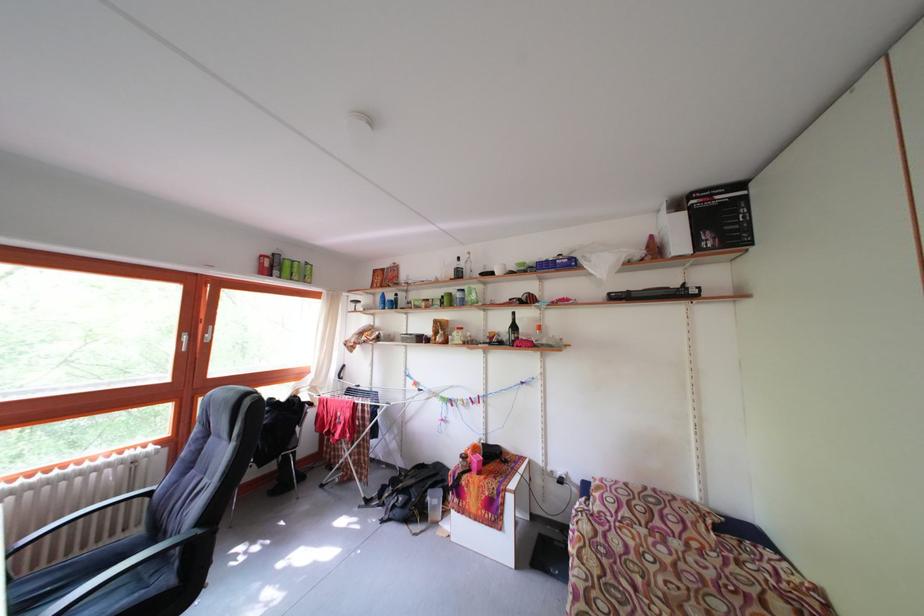
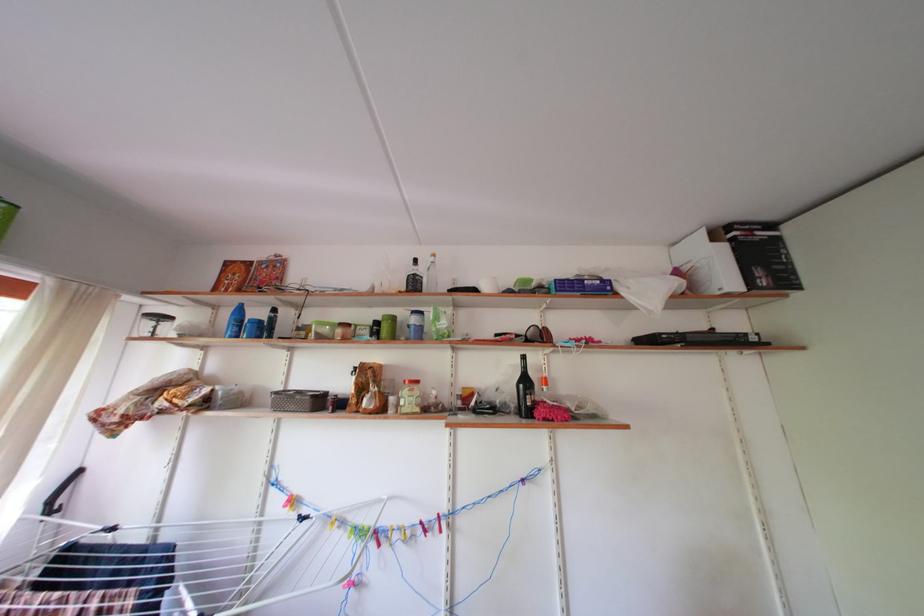
Where in the second image is the point corresponding to [523,333] from the first image?

(533, 387)